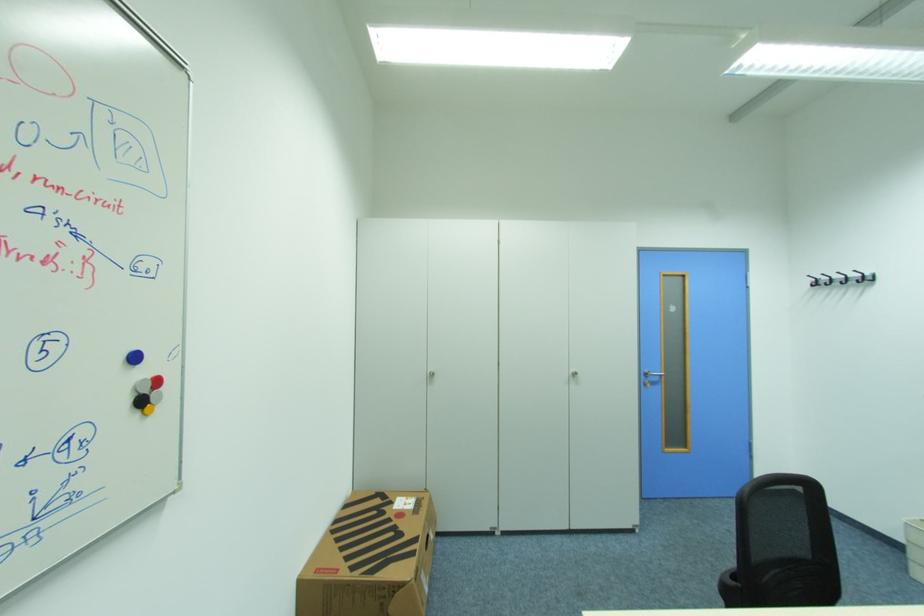
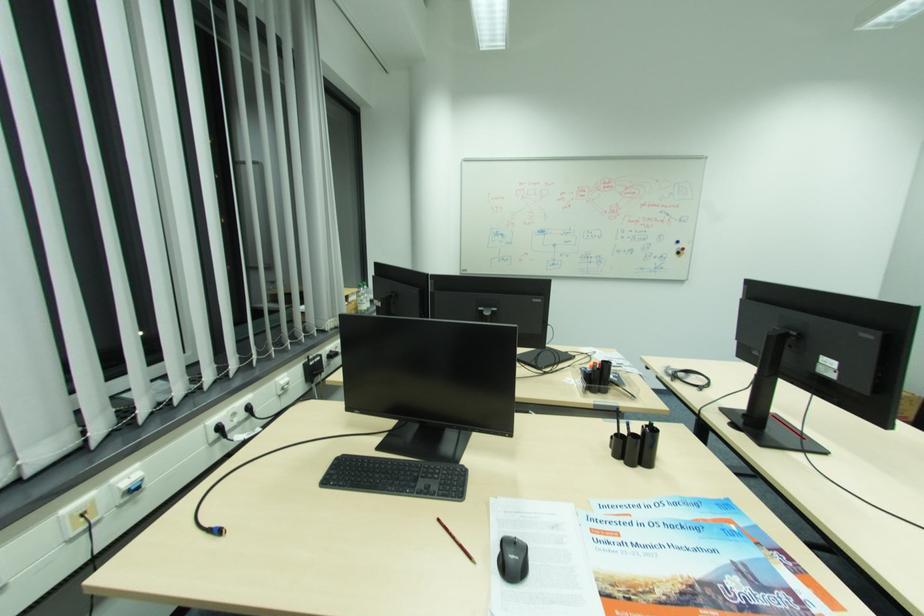
The point at (146,403) is marked in the first image. Where is the corresponding point in the second image?

(684, 253)